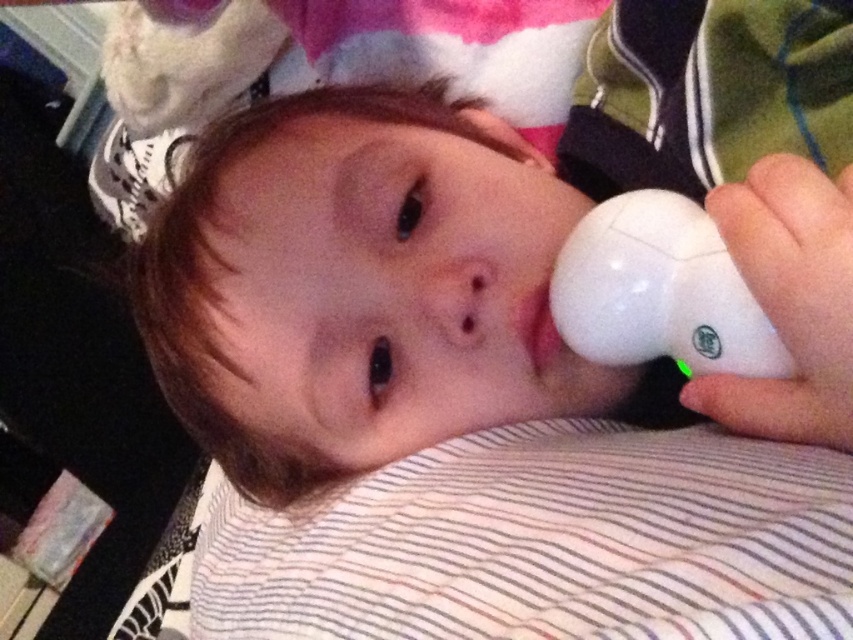
Question: Considering the relative positions of white matte pacifier at center and white matte remote control at lower right in the image provided, where is white matte pacifier at center located with respect to white matte remote control at lower right?

Choices:
 (A) left
 (B) right

Answer: (A)

Question: From the image, what is the correct spatial relationship of white matte pacifier at center in relation to white matte remote control at lower right?

Choices:
 (A) right
 (B) left

Answer: (B)

Question: Does white matte pacifier at center have a larger size compared to white matte remote control at lower right?

Choices:
 (A) no
 (B) yes

Answer: (B)

Question: Which point is farther to the camera?

Choices:
 (A) (639, 289)
 (B) (375, 106)

Answer: (B)